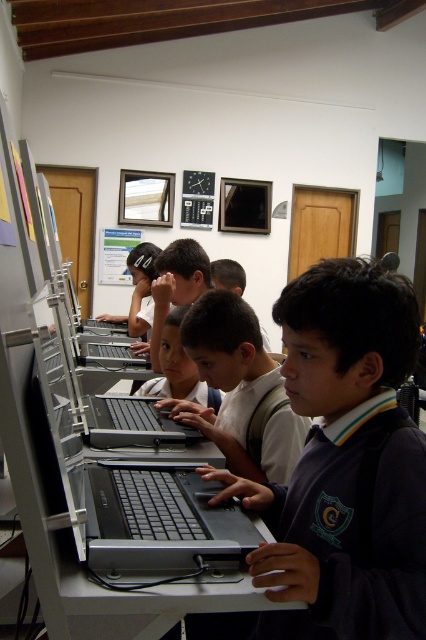
In the scene shown: Between black plastic laptop at center and smooth skin child at center, which one appears on the right side from the viewer's perspective?

Positioned to the right is black plastic laptop at center.

Does point (184, 518) come farther from viewer compared to point (172, 392)?

No, (184, 518) is in front of (172, 392).

At what (x,y) coordinates should I click in order to perform the action: click on black plastic laptop at center. Please return your answer as a coordinate pair (x, y). Looking at the image, I should click on click(x=164, y=522).

Is point (164, 509) in front of point (100, 422)?

Yes, point (164, 509) is in front of point (100, 422).

Which is more to the left, black plastic laptop at center or black matte laptop at center?

From the viewer's perspective, black matte laptop at center appears more on the left side.

Is point (201, 552) behind point (175, 433)?

No, (201, 552) is closer to viewer.

Where is `black plastic laptop at center`? The height and width of the screenshot is (640, 426). black plastic laptop at center is located at coordinates (164, 522).

Is dark blue uniform at center to the left of silver metallic laptop at center from the viewer's perspective?

In fact, dark blue uniform at center is to the right of silver metallic laptop at center.

Who is positioned more to the right, dark blue uniform at center or silver metallic laptop at center?

dark blue uniform at center is more to the right.

Who is more forward, [327,552] or [103,355]?

Point [327,552] is in front.

Where is `dark blue uniform at center`? dark blue uniform at center is located at coordinates (345, 464).